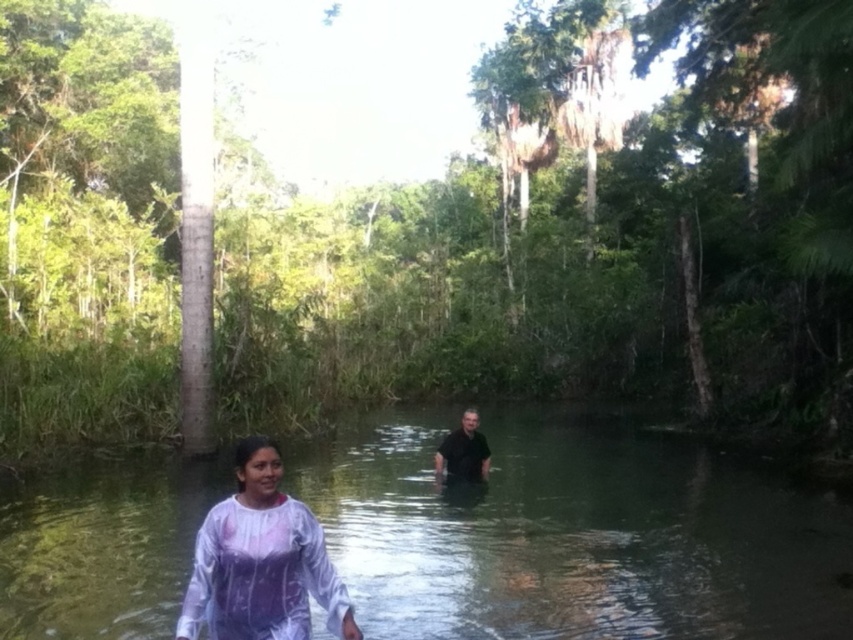
Question: Is clear water at center to the left of white matte dress at center from the viewer's perspective?

Choices:
 (A) yes
 (B) no

Answer: (B)

Question: Among these objects, which one is nearest to the camera?

Choices:
 (A) clear water at center
 (B) white matte dress at center

Answer: (B)

Question: Estimate the real-world distances between objects in this image. Which object is farther from the black matte shirt at center?

Choices:
 (A) white matte dress at center
 (B) clear water at center

Answer: (A)

Question: Which point appears farthest from the camera in this image?

Choices:
 (A) (294, 596)
 (B) (457, 436)
 (C) (728, 493)

Answer: (C)

Question: Does clear water at center come in front of white matte dress at center?

Choices:
 (A) yes
 (B) no

Answer: (B)

Question: Can you confirm if clear water at center is positioned to the left of black matte shirt at center?

Choices:
 (A) yes
 (B) no

Answer: (A)